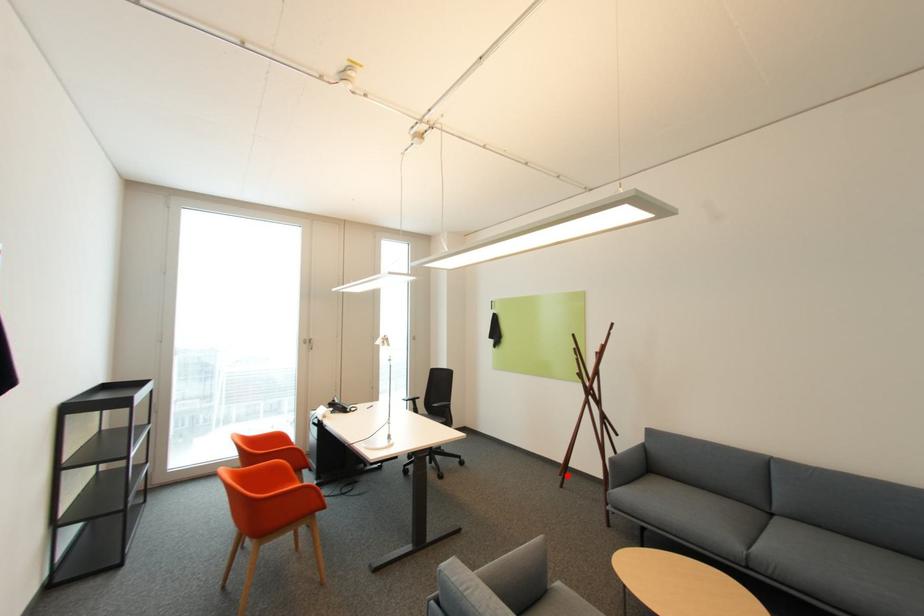
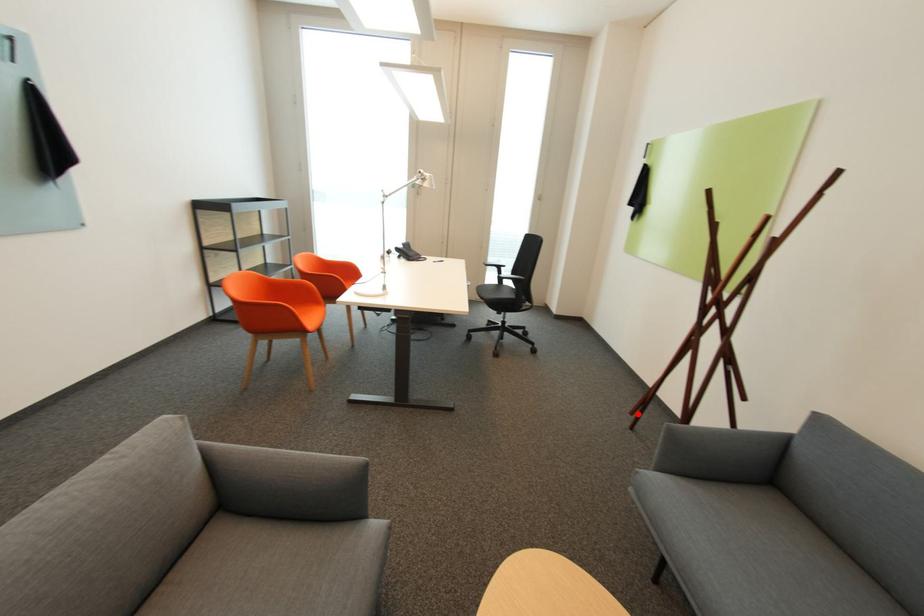
I am providing you with two images of the same scene from different viewpoints. A red point is marked on the first image and another point is marked on the second image. Is the red point in image1 aligned with the point shown in image2?

Yes